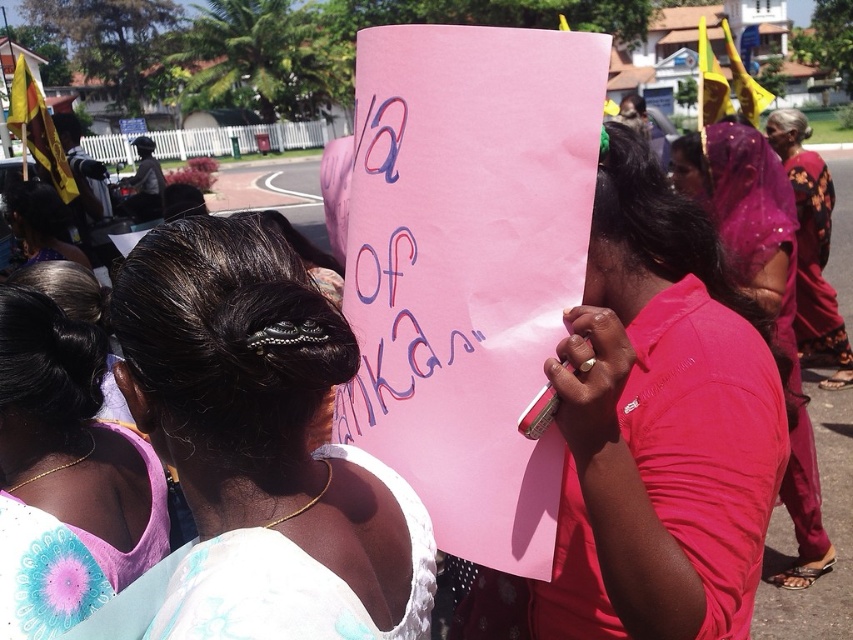
Question: Considering the relative positions of purple fabric blouse at upper left and purple sheer veil at upper right in the image provided, where is purple fabric blouse at upper left located with respect to purple sheer veil at upper right?

Choices:
 (A) right
 (B) left

Answer: (B)

Question: Which object is farther from the camera taking this photo?

Choices:
 (A) purple sheer veil at upper right
 (B) white lace blouse at lower left
 (C) purple fabric blouse at upper left

Answer: (A)

Question: Which point is closer to the camera?

Choices:
 (A) pink paper sign at center
 (B) white lace blouse at lower left
 (C) purple sheer veil at upper right

Answer: (B)

Question: Which point is farther to the camera?

Choices:
 (A) (65, 580)
 (B) (126, 326)
 (C) (619, 336)
 (D) (677, 148)

Answer: (D)

Question: Is purple fabric blouse at upper left below floral silk sari at right?

Choices:
 (A) no
 (B) yes

Answer: (B)

Question: Is pink paper sign at center to the right of floral silk sari at right from the viewer's perspective?

Choices:
 (A) no
 (B) yes

Answer: (A)